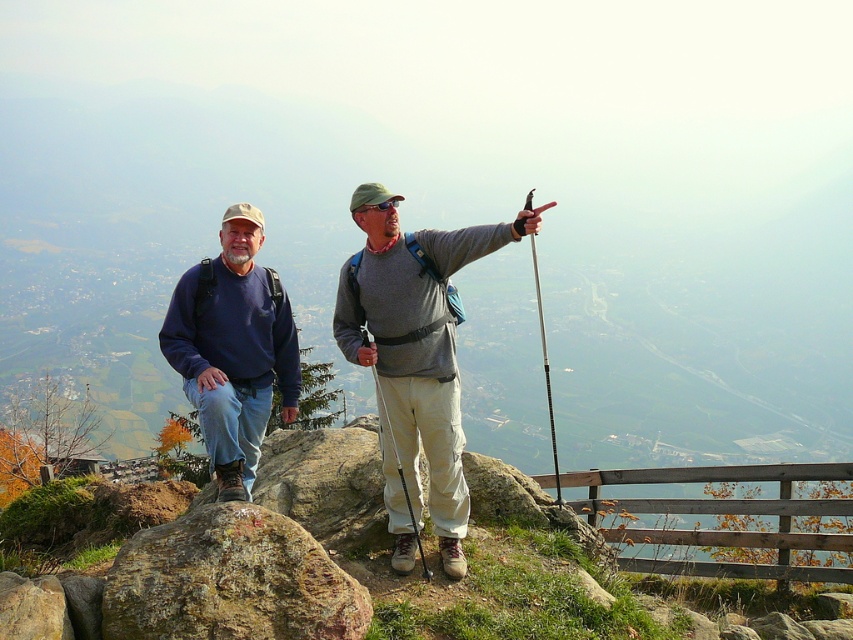
Question: Does gray fabric shirt at center appear on the right side of matte blue sweatshirt at left?

Choices:
 (A) no
 (B) yes

Answer: (B)

Question: Is gray fabric shirt at center bigger than brown rough rock at lower left?

Choices:
 (A) no
 (B) yes

Answer: (B)

Question: Among these objects, which one is farthest from the camera?

Choices:
 (A) brown rough rock at lower left
 (B) matte blue sweatshirt at left

Answer: (B)

Question: Is gray fabric shirt at center thinner than matte blue sweatshirt at left?

Choices:
 (A) yes
 (B) no

Answer: (A)

Question: Which of the following is the farthest from the observer?

Choices:
 (A) (241, 496)
 (B) (274, 564)

Answer: (A)

Question: Which point is closer to the camera?

Choices:
 (A) gray fabric shirt at center
 (B) matte blue sweatshirt at left
 (C) brown rough rock at lower left

Answer: (C)